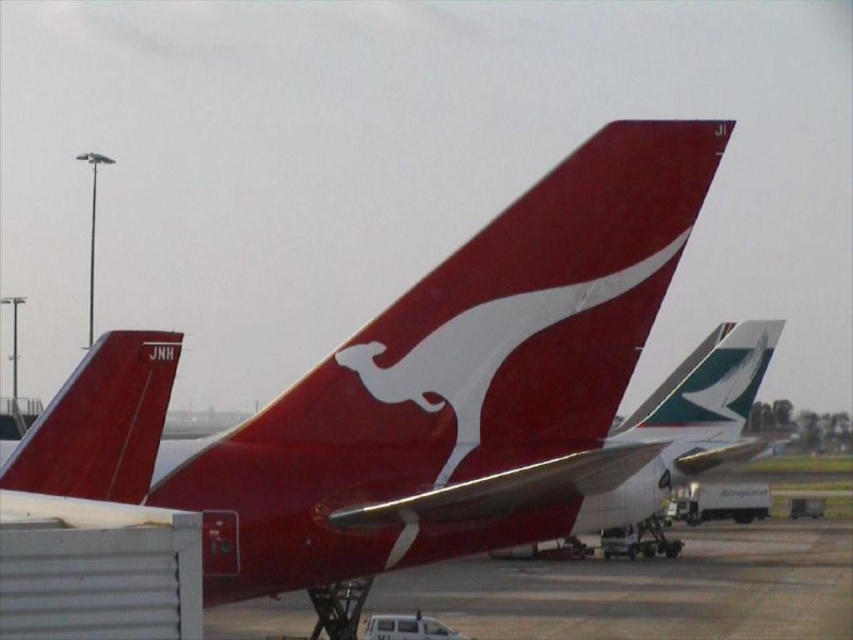
Question: Is matte red airplane at center positioned behind matte red tail fin at left?

Choices:
 (A) yes
 (B) no

Answer: (A)

Question: Observing the image, what is the correct spatial positioning of matte red airplane at center in reference to matte red tail fin at left?

Choices:
 (A) above
 (B) below

Answer: (A)

Question: Is matte red airplane at center positioned in front of matte red tail fin at left?

Choices:
 (A) no
 (B) yes

Answer: (A)

Question: Which of the following is the farthest from the observer?

Choices:
 (A) (135, 429)
 (B) (508, 282)

Answer: (B)

Question: Which of the following is the closest to the observer?

Choices:
 (A) (608, 228)
 (B) (108, 362)

Answer: (B)